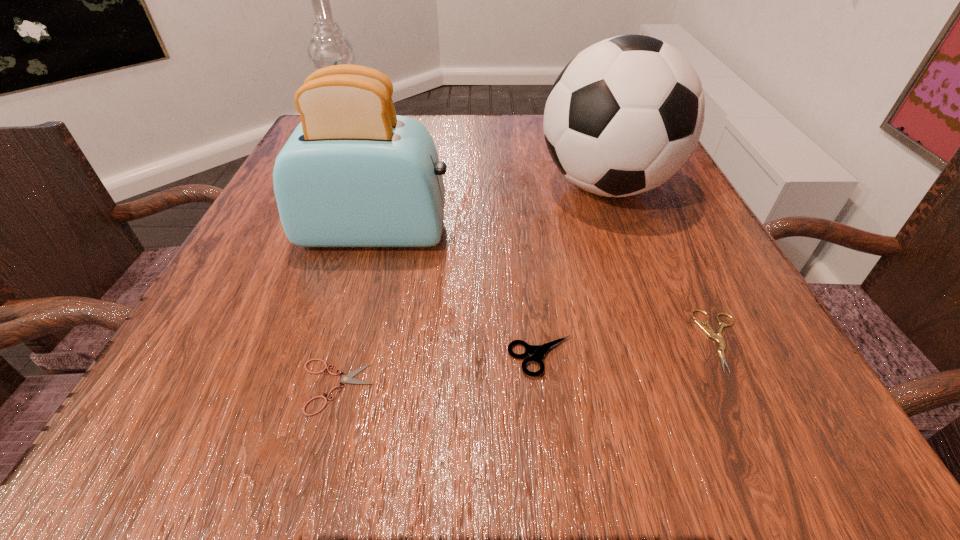
At what (x,y) coordinates should I click in order to perform the action: click on free space between the toaster and the soccer ball. Please return your answer as a coordinate pair (x, y). The image size is (960, 540). Looking at the image, I should click on (491, 209).

At what (x,y) coordinates should I click in order to perform the action: click on unoccupied position between the fifth tallest object and the oil lamp. Please return your answer as a coordinate pair (x, y). Looking at the image, I should click on click(x=538, y=243).

The width and height of the screenshot is (960, 540). In order to click on free space between the oil lamp and the fifth tallest object in this screenshot , I will do `click(538, 243)`.

Identify the location of empty space between the soccer ball and the second shears from left to right. (574, 271).

I want to click on vacant area that lies between the toaster and the soccer ball, so click(x=491, y=209).

This screenshot has width=960, height=540. I want to click on vacant space that's between the shortest object and the third shortest object, so click(439, 372).

You are a GUI agent. You are given a task and a screenshot of the screen. Output one action in this format:
    pyautogui.click(x=<x>, y=<y>)
    Task: Click on the vacant area that lies between the toaster and the shortest shears
    The width and height of the screenshot is (960, 540).
    Given the screenshot: What is the action you would take?
    pyautogui.click(x=355, y=309)

Find the location of a particular element. Image resolution: width=960 pixels, height=540 pixels. vacant area that lies between the oil lamp and the fourth tallest object is located at coordinates (446, 251).

Image resolution: width=960 pixels, height=540 pixels. Find the location of `object that stands as the second closest to the toaster`. object that stands as the second closest to the toaster is located at coordinates (328, 46).

Identify the location of object that is the fifth nearest to the oil lamp. This screenshot has height=540, width=960. (709, 331).